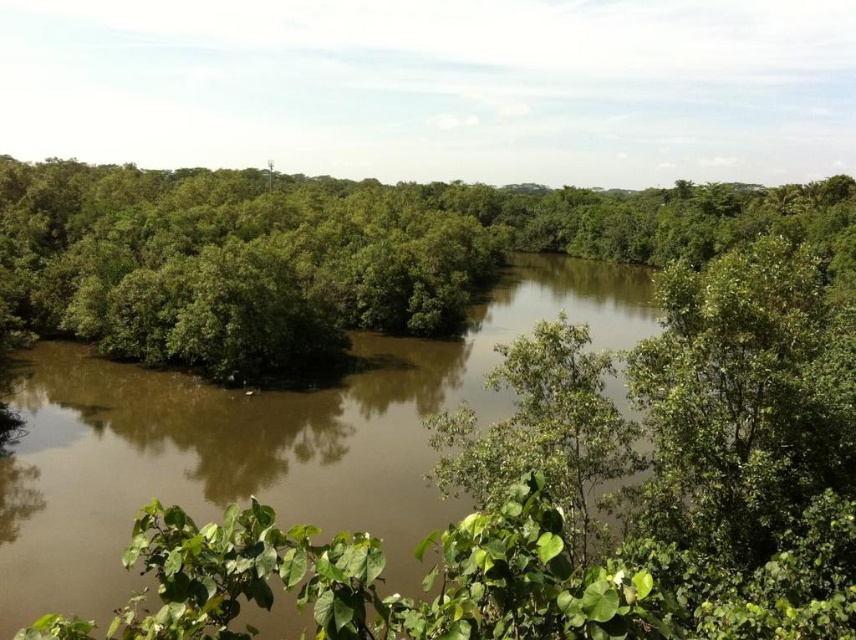
Looking at this image, you are standing in the middle of the scene and want to walk towards the green leafy trees at center and the brown muddy water at center. Which one will you reach first?

You will reach the green leafy trees at center first because they are closer to you than the brown muddy water at center.

Based on the scene description, which object at the center has a bigger size between the green leafy trees at center and the brown muddy water at center?

The green leafy trees at center has a larger size compared to brown muddy water at center according to the description.

You are a photographer trying to capture the entire scene in one shot. Given that your camera can only focus on objects wider than 3 meters, will both the green leafy trees at center and the brown muddy water at center be in focus?

The green leafy trees at center are wider than the brown muddy water at center. Since the camera focuses on objects wider than 3 meters, both objects will be in focus as their widths exceed the minimum requirement.